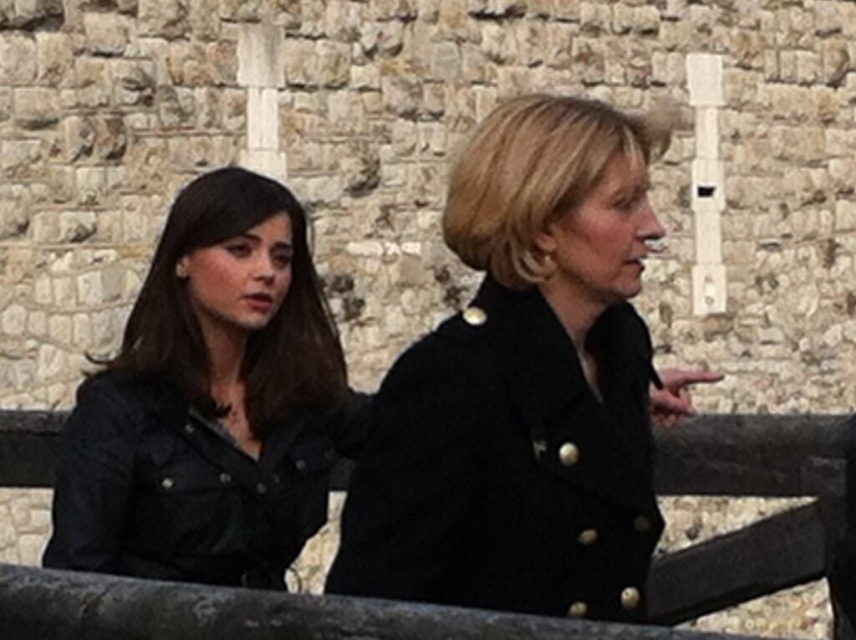
Based on the photo, does matte black jacket at left appear over smooth wooden fence at center?

Incorrect, matte black jacket at left is not positioned above smooth wooden fence at center.

Does matte black jacket at left appear on the left side of smooth wooden fence at center?

Indeed, matte black jacket at left is positioned on the left side of smooth wooden fence at center.

Is point (295, 301) positioned after point (750, 536)?

Yes, point (295, 301) is behind point (750, 536).

Image resolution: width=856 pixels, height=640 pixels. In order to click on matte black jacket at left in this screenshot , I will do `click(209, 403)`.

Is black matte coat at center positioned in front of smooth wooden fence at center?

No, it is behind smooth wooden fence at center.

Between black matte coat at center and smooth wooden fence at center, which one appears on the left side from the viewer's perspective?

smooth wooden fence at center

Does point (519, 348) lie in front of point (696, 566)?

Yes, it is.

Image resolution: width=856 pixels, height=640 pixels. Identify the location of black matte coat at center. (524, 387).

Does point (568, 304) lie in front of point (182, 221)?

That is True.

Between point (495, 336) and point (62, 492), which one is positioned behind?

Positioned behind is point (62, 492).

Locate an element on the screen. The height and width of the screenshot is (640, 856). black matte coat at center is located at coordinates (524, 387).